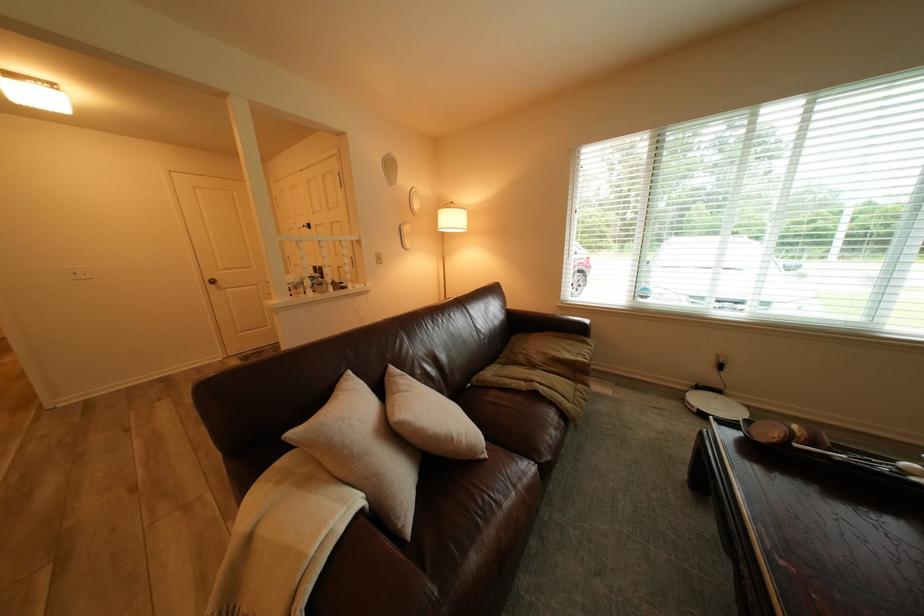
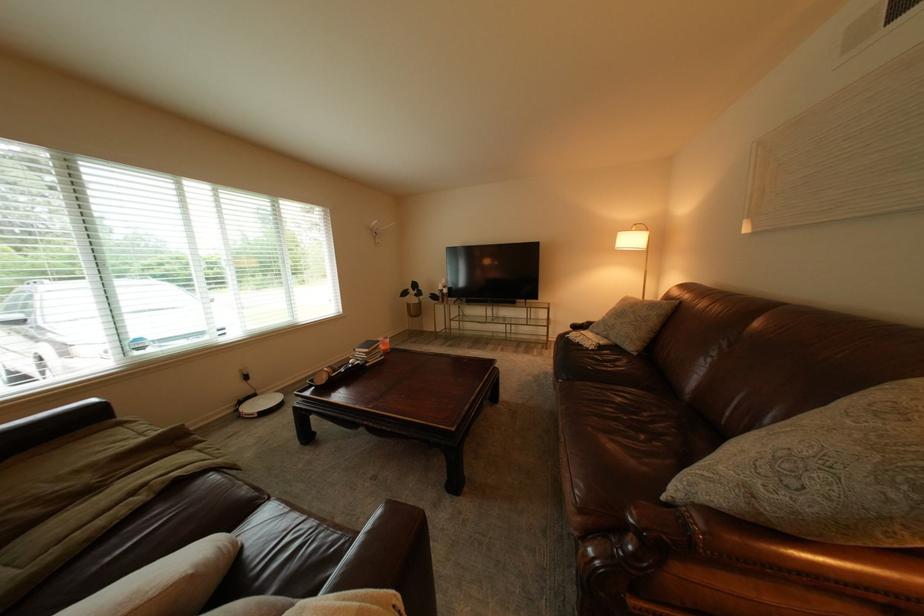
The point at (523, 387) is marked in the first image. Where is the corresponding point in the second image?

(130, 523)